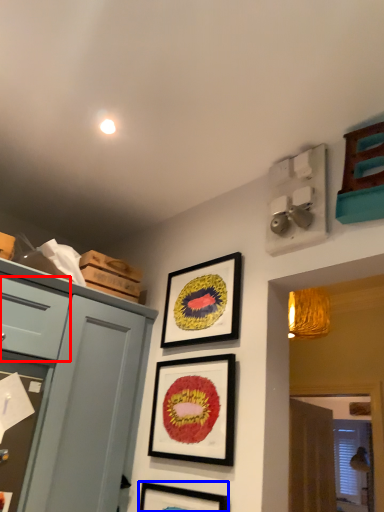
Question: Among these objects, which one is farthest to the camera, drawer (highlighted by a red box) or picture frame (highlighted by a blue box)?

Choices:
 (A) drawer
 (B) picture frame

Answer: (A)